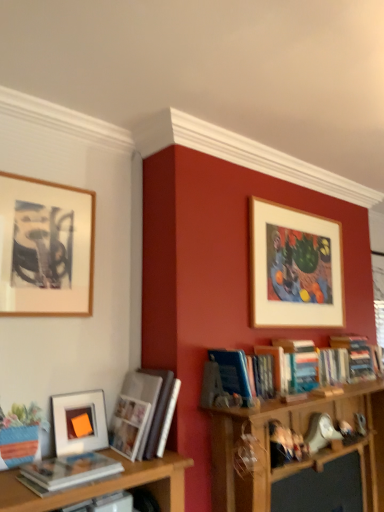
Locate an element on the screen. matte white picture frame at left, the second picture frame when ordered from front to back is located at coordinates (79, 422).

What do you see at coordinates (355, 356) in the screenshot?
I see `hardcover books at upper right, the first book when ordered from right to left` at bounding box center [355, 356].

Consider the image. Measure the distance between white matte megaphone at center-right and camera.

They are 2.19 meters apart.

What do you see at coordinates (70, 470) in the screenshot?
I see `matte white book at lower left, the 1th book when ordered from left to right` at bounding box center [70, 470].

Find the location of a particular element. The height and width of the screenshot is (512, 384). white glossy photo album at left, arranged as the 4th book when viewed from the right is located at coordinates (148, 414).

From the image's perspective, is wooden framed artwork at upper left, which is the third picture frame in back-to-front order, located above hardcover books at upper right, which ranks as the 5th book in left-to-right order?

Indeed, from the image's perspective, wooden framed artwork at upper left, which is the third picture frame in back-to-front order, is shown above hardcover books at upper right, which ranks as the 5th book in left-to-right order.

Is point (55, 203) farther from viewer compared to point (368, 355)?

No, (55, 203) is closer to viewer.

Is wooden framed artwork at upper left, which is the third picture frame in back-to-front order, far away from hardcover books at upper right, the first book when ordered from right to left?

That's right, there is a large distance between wooden framed artwork at upper left, which is the third picture frame in back-to-front order, and hardcover books at upper right, the first book when ordered from right to left.

Does wooden framed artwork at upper left, which is the third picture frame in back-to-front order, have a lesser width compared to hardcover books at upper right, which ranks as the 5th book in left-to-right order?

Correct, the width of wooden framed artwork at upper left, which is the third picture frame in back-to-front order, is less than that of hardcover books at upper right, which ranks as the 5th book in left-to-right order.

From a real-world perspective, is wooden framed artwork at upper left, placed as the 1th picture frame when sorted from front to back, physically above hardcover book at upper right, arranged as the second book when viewed from the right?

Yes.

From the picture: Are wooden framed artwork at upper left, the 3th picture frame positioned from the right, and hardcover book at upper right, arranged as the second book when viewed from the right, far apart?

Absolutely, wooden framed artwork at upper left, the 3th picture frame positioned from the right, is distant from hardcover book at upper right, arranged as the second book when viewed from the right.

Is wooden framed artwork at upper left, which is the third picture frame in back-to-front order, oriented towards hardcover book at upper right, which is the 4th book from left to right?

No, wooden framed artwork at upper left, which is the third picture frame in back-to-front order, is not oriented towards hardcover book at upper right, which is the 4th book from left to right.

Does wooden framed artwork at upper left, placed as the 1th picture frame when sorted from front to back, appear on the right side of hardcover book at upper right, arranged as the second book when viewed from the right?

Incorrect, wooden framed artwork at upper left, placed as the 1th picture frame when sorted from front to back, is not on the right side of hardcover book at upper right, arranged as the second book when viewed from the right.

Considering the relative positions of hardcover book at upper right, arranged as the second book when viewed from the right, and white glossy photo album at left, placed as the 2th book when sorted from left to right, in the image provided, is hardcover book at upper right, arranged as the second book when viewed from the right, in front of white glossy photo album at left, placed as the 2th book when sorted from left to right,?

No, it is not.

In the scene shown: Can you see hardcover book at upper right, which is the 4th book from left to right, touching white glossy photo album at left, placed as the 2th book when sorted from left to right?

hardcover book at upper right, which is the 4th book from left to right, is not next to white glossy photo album at left, placed as the 2th book when sorted from left to right, and they're not touching.

Between hardcover book at upper right, arranged as the second book when viewed from the right, and white glossy photo album at left, arranged as the 4th book when viewed from the right, which one has smaller size?

hardcover book at upper right, arranged as the second book when viewed from the right.

Considering the sizes of objects hardcover book at upper right, which is the 4th book from left to right, and white glossy photo album at left, placed as the 2th book when sorted from left to right, in the image provided, who is shorter, hardcover book at upper right, which is the 4th book from left to right, or white glossy photo album at left, placed as the 2th book when sorted from left to right,?

With less height is hardcover book at upper right, which is the 4th book from left to right.

Is white matte megaphone at center-right in front of or behind wooden picture frame at upper right, which is the 1th picture frame from right to left, in the image?

In the image, white matte megaphone at center-right appears behind wooden picture frame at upper right, which is the 1th picture frame from right to left.

Is white matte megaphone at center-right far away from wooden picture frame at upper right, which ranks as the first picture frame in back-to-front order?

No.

What's the angular difference between white matte megaphone at center-right and wooden picture frame at upper right, which is the 1th picture frame from right to left,'s facing directions?

The angular difference between white matte megaphone at center-right and wooden picture frame at upper right, which is the 1th picture frame from right to left, is 1.25 degrees.

Is white matte megaphone at center-right situated inside wooden picture frame at upper right, which ranks as the first picture frame in back-to-front order, or outside?

white matte megaphone at center-right is outside wooden picture frame at upper right, which ranks as the first picture frame in back-to-front order.

Where is `the 2nd picture frame located above the white glossy photo album at left, placed as the 2th book when sorted from left to right (from a real-world perspective)`? the 2nd picture frame located above the white glossy photo album at left, placed as the 2th book when sorted from left to right (from a real-world perspective) is located at coordinates (45, 248).

From a real-world perspective, which is physically above, white glossy photo album at left, placed as the 2th book when sorted from left to right, or wooden framed artwork at upper left, placed as the 1th picture frame when sorted from front to back?

From a 3D spatial view, wooden framed artwork at upper left, placed as the 1th picture frame when sorted from front to back, is above.

Is white glossy photo album at left, arranged as the 4th book when viewed from the right, directly adjacent to wooden framed artwork at upper left, placed as the 1th picture frame when sorted from front to back?

white glossy photo album at left, arranged as the 4th book when viewed from the right, and wooden framed artwork at upper left, placed as the 1th picture frame when sorted from front to back, are clearly separated.

From the image's perspective, would you say white glossy photo album at left, arranged as the 4th book when viewed from the right, is positioned over wooden framed artwork at upper left, placed as the 1th picture frame when sorted from front to back?

Incorrect, from the image's perspective, white glossy photo album at left, arranged as the 4th book when viewed from the right, is lower than wooden framed artwork at upper left, placed as the 1th picture frame when sorted from front to back.

Does wooden framed artwork at upper left, the first picture frame positioned from the left, touch white matte megaphone at center-right?

There is a gap between wooden framed artwork at upper left, the first picture frame positioned from the left, and white matte megaphone at center-right.

Does wooden framed artwork at upper left, the 3th picture frame positioned from the right, have a greater width compared to white matte megaphone at center-right?

In fact, wooden framed artwork at upper left, the 3th picture frame positioned from the right, might be narrower than white matte megaphone at center-right.

Can you confirm if wooden framed artwork at upper left, placed as the 1th picture frame when sorted from front to back, is shorter than white matte megaphone at center-right?

No, wooden framed artwork at upper left, placed as the 1th picture frame when sorted from front to back, is not shorter than white matte megaphone at center-right.

Does wooden framed artwork at upper left, which is the third picture frame in back-to-front order, turn towards wooden picture frame at upper right, which ranks as the first picture frame in back-to-front order?

No, wooden framed artwork at upper left, which is the third picture frame in back-to-front order, is not oriented towards wooden picture frame at upper right, which ranks as the first picture frame in back-to-front order.

Is point (19, 286) positioned in front of point (278, 233)?

That is True.

Consider the image. Could wooden picture frame at upper right, which ranks as the 3th picture frame in left-to-right order, be considered to be inside wooden framed artwork at upper left, placed as the 1th picture frame when sorted from front to back?

No, wooden framed artwork at upper left, placed as the 1th picture frame when sorted from front to back, does not contain wooden picture frame at upper right, which ranks as the 3th picture frame in left-to-right order.

From the wooden framed artwork at upper left, which is the third picture frame in back-to-front order, count 5th book to the right and point to it. Please provide its 2D coordinates.

[(355, 356)]

What are the coordinates of `the 3rd picture frame to the left of the hardcover book at upper right, which is the 4th book from left to right, starting your count from the anchor` in the screenshot? It's located at (45, 248).

Estimate the real-world distances between objects in this image. Which object is further from matte white book at lower left, which ranks as the fifth book in right-to-left order, white glossy photo album at left, placed as the 2th book when sorted from left to right, or hardcover books at upper right, which ranks as the 5th book in left-to-right order?

hardcover books at upper right, which ranks as the 5th book in left-to-right order.

Which object lies further to the anchor point hardcover books at upper right, the first book when ordered from right to left, wooden picture frame at upper right, which is the 1th picture frame from right to left, or blue hardcover book at center-right, the 3th book in the left-to-right sequence?

The object further to hardcover books at upper right, the first book when ordered from right to left, is wooden picture frame at upper right, which is the 1th picture frame from right to left.

When comparing their distances from blue hardcover book at center-right, the 3th book in the left-to-right sequence, does matte white book at lower left, which ranks as the fifth book in right-to-left order, or hardcover books at upper right, which ranks as the 5th book in left-to-right order, seem closer?

hardcover books at upper right, which ranks as the 5th book in left-to-right order, is closer to blue hardcover book at center-right, the 3th book in the left-to-right sequence.

Based on their spatial positions, is hardcover book at upper right, which is the 4th book from left to right, or white matte megaphone at center-right closer to blue hardcover book at center-right, the 3th book in the left-to-right sequence?

hardcover book at upper right, which is the 4th book from left to right, lies closer to blue hardcover book at center-right, the 3th book in the left-to-right sequence, than the other object.

Estimate the real-world distances between objects in this image. Which object is further from wooden picture frame at upper right, which ranks as the 3th picture frame in left-to-right order, white matte megaphone at center-right or hardcover book at upper right, arranged as the second book when viewed from the right?

white matte megaphone at center-right is further to wooden picture frame at upper right, which ranks as the 3th picture frame in left-to-right order.

Which object lies further to the anchor point white matte megaphone at center-right, hardcover books at upper right, which ranks as the 5th book in left-to-right order, or white glossy photo album at left, arranged as the 4th book when viewed from the right?

Based on the image, white glossy photo album at left, arranged as the 4th book when viewed from the right, appears to be further to white matte megaphone at center-right.

Looking at the image, which one is located further to wooden framed artwork at upper left, the 3th picture frame positioned from the right, hardcover book at upper right, which is the 4th book from left to right, or white matte megaphone at center-right?

white matte megaphone at center-right.

Considering their positions, is hardcover books at upper right, which ranks as the 5th book in left-to-right order, positioned further to matte white book at lower left, which ranks as the fifth book in right-to-left order, than wooden picture frame at upper right, which is the 3th picture frame from front to back?

Based on the image, hardcover books at upper right, which ranks as the 5th book in left-to-right order, appears to be further to matte white book at lower left, which ranks as the fifth book in right-to-left order.

Locate an element on the screen. The height and width of the screenshot is (512, 384). toy between white glossy photo album at left, arranged as the 4th book when viewed from the right, and hardcover books at upper right, which ranks as the 5th book in left-to-right order is located at coordinates (320, 432).

Locate an element on the screen. picture frame between matte white picture frame at left, the 2th picture frame in the right-to-left sequence, and white matte megaphone at center-right, in the horizontal direction is located at coordinates (294, 268).

This screenshot has height=512, width=384. I want to click on toy located between white glossy photo album at left, arranged as the 4th book when viewed from the right, and hardcover book at upper right, arranged as the second book when viewed from the right, in the left-right direction, so click(x=320, y=432).

Locate an element on the screen. picture frame between matte white picture frame at left, the 2th picture frame from the left, and hardcover books at upper right, the first book when ordered from right to left, from left to right is located at coordinates (294, 268).